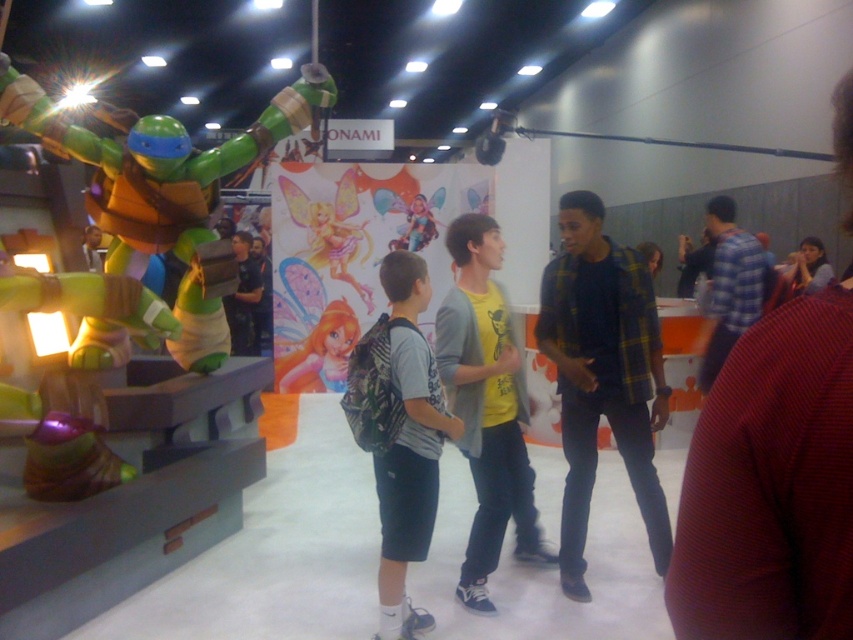
Question: From the image, what is the correct spatial relationship of yellow matte t-shirt at center in relation to gray fabric backpack at center?

Choices:
 (A) above
 (B) below

Answer: (A)

Question: Is green matte turtle at left above gray fabric backpack at center?

Choices:
 (A) yes
 (B) no

Answer: (A)

Question: Which point is farther from the camera taking this photo?

Choices:
 (A) (799, 342)
 (B) (300, 387)
 (C) (809, 237)

Answer: (B)

Question: Observing the image, what is the correct spatial positioning of green matte turtle at left in reference to gray fabric backpack at center?

Choices:
 (A) above
 (B) below

Answer: (A)

Question: Which object is closer to the camera taking this photo?

Choices:
 (A) gray fabric backpack at center
 (B) plaid flannel shirt at center

Answer: (A)

Question: Which point is closer to the camera taking this photo?

Choices:
 (A) (x=399, y=259)
 (B) (x=485, y=326)

Answer: (A)